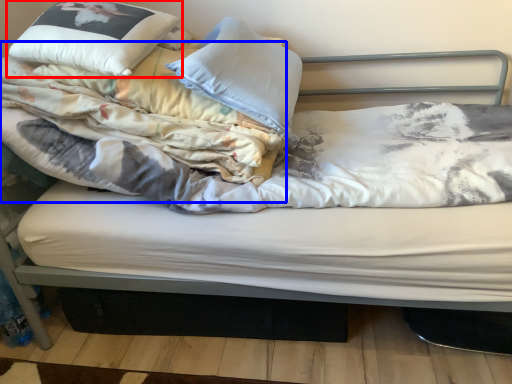
Question: Which point is closer to the camera, pillow (highlighted by a red box) or blanket (highlighted by a blue box)?

Choices:
 (A) pillow
 (B) blanket

Answer: (B)